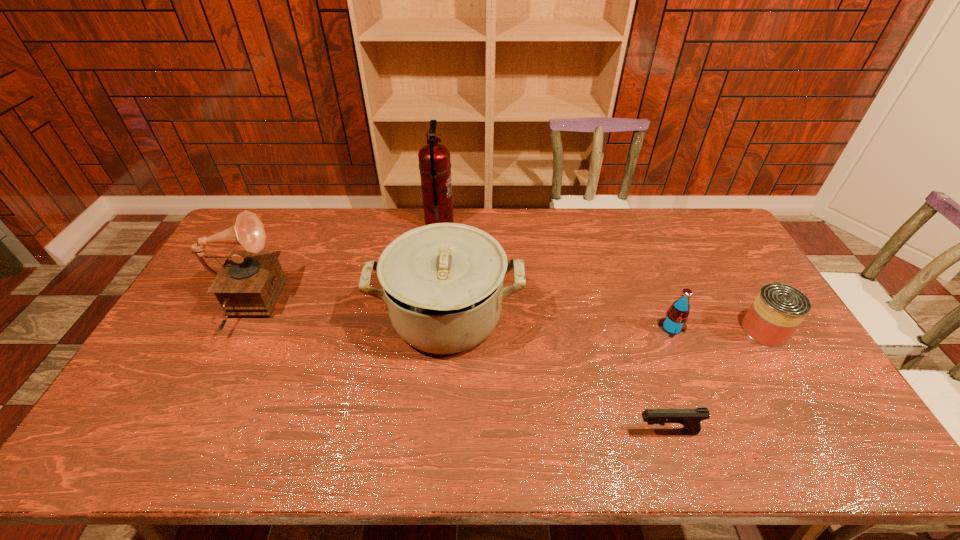
You are a GUI agent. You are given a task and a screenshot of the screen. Output one action in this format:
    pyautogui.click(x=<x>, y=<y>)
    Task: Click on the unoccupied position between the soda and the nearest object
    This screenshot has width=960, height=540.
    Given the screenshot: What is the action you would take?
    pyautogui.click(x=669, y=380)

Where is `empty space that is in between the shortest object and the rightmost object`? empty space that is in between the shortest object and the rightmost object is located at coordinates (715, 381).

This screenshot has width=960, height=540. Find the location of `vacant space in between the soda and the pistol`. vacant space in between the soda and the pistol is located at coordinates (669, 380).

At what (x,y) coordinates should I click in order to perform the action: click on free space that is in between the record player and the tallest object. Please return your answer as a coordinate pair (x, y). Image resolution: width=960 pixels, height=540 pixels. Looking at the image, I should click on (343, 266).

Where is `the fifth closest object to the leftmost object`? The height and width of the screenshot is (540, 960). the fifth closest object to the leftmost object is located at coordinates (778, 309).

What are the coordinates of `object that is the third closest to the tallest object` in the screenshot? It's located at (675, 321).

You are a GUI agent. You are given a task and a screenshot of the screen. Output one action in this format:
    pyautogui.click(x=<x>, y=<y>)
    Task: Click on the vacant area in the image that satisfies the following two spatial constraints: 1. on the horn of the soda; 2. on the right side of the record player
    This screenshot has height=540, width=960.
    Given the screenshot: What is the action you would take?
    pyautogui.click(x=235, y=328)

The width and height of the screenshot is (960, 540). I want to click on blank area in the image that satisfies the following two spatial constraints: 1. on the front side of the can; 2. at the barrel of the pistol, so click(825, 431).

You are a GUI agent. You are given a task and a screenshot of the screen. Output one action in this format:
    pyautogui.click(x=<x>, y=<y>)
    Task: Click on the free point that satisfies the following two spatial constraints: 1. on the back side of the saucepan; 2. on the horn of the leftmost object
    
    Given the screenshot: What is the action you would take?
    [447, 307]

Image resolution: width=960 pixels, height=540 pixels. What are the coordinates of `vacant space that satisfies the following two spatial constraints: 1. on the horn of the record player; 2. on the left side of the soda` in the screenshot? It's located at (235, 328).